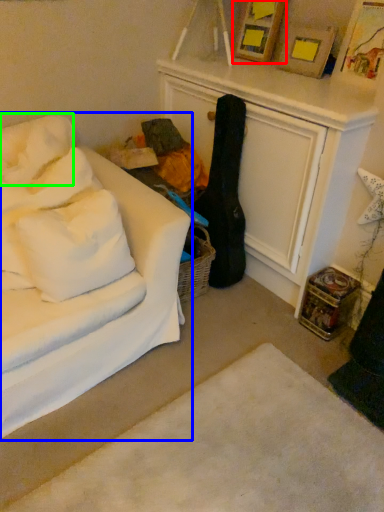
Question: Which object is the farthest from picture frame (highlighted by a red box)? Choose among these: studio couch (highlighted by a blue box) or pillow (highlighted by a green box).

Choices:
 (A) studio couch
 (B) pillow

Answer: (A)